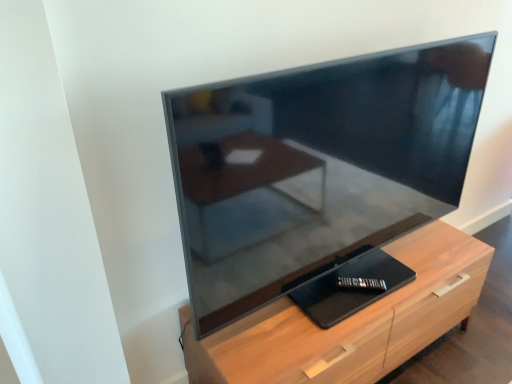
Question: From their relative heights in the image, would you say light wood chest of drawers at center is taller or shorter than matte black tv at center?

Choices:
 (A) tall
 (B) short

Answer: (B)

Question: Is light wood chest of drawers at center inside or outside of matte black tv at center?

Choices:
 (A) outside
 (B) inside

Answer: (A)

Question: Is light wood chest of drawers at center wider or thinner than matte black tv at center?

Choices:
 (A) wide
 (B) thin

Answer: (A)

Question: Based on their positions, is matte black tv at center located to the left or right of light wood chest of drawers at center?

Choices:
 (A) left
 (B) right

Answer: (A)

Question: From a real-world perspective, is matte black tv at center positioned above or below light wood chest of drawers at center?

Choices:
 (A) below
 (B) above

Answer: (B)

Question: From the image's perspective, is matte black tv at center located above or below light wood chest of drawers at center?

Choices:
 (A) above
 (B) below

Answer: (A)

Question: Is matte black tv at center bigger or smaller than light wood chest of drawers at center?

Choices:
 (A) big
 (B) small

Answer: (A)